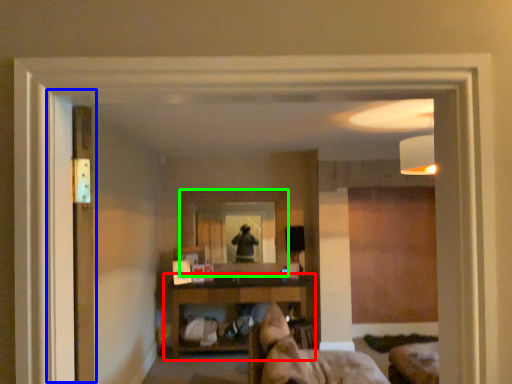
Question: Which object is positioned closest to shelf (highlighted by a red box)? Select from screen door (highlighted by a blue box) and mirror (highlighted by a green box).

Choices:
 (A) screen door
 (B) mirror

Answer: (B)